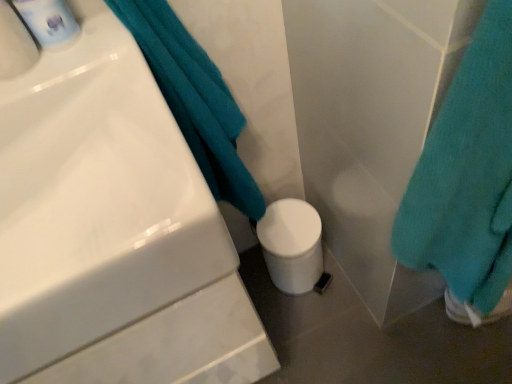
Question: In terms of height, does teal soft towel at lower right, the 2th bath towel viewed from the left, look taller or shorter compared to teal soft towel at upper left, which appears as the second bath towel when viewed from the right?

Choices:
 (A) tall
 (B) short

Answer: (A)

Question: In the image, is teal soft towel at lower right, the 2th bath towel viewed from the left, on the left side or the right side of teal soft towel at upper left, which appears as the second bath towel when viewed from the right?

Choices:
 (A) left
 (B) right

Answer: (B)

Question: Estimate the real-world distances between objects in this image. Which object is closer to the white glossy mouthwash at upper left?

Choices:
 (A) teal soft towel at lower right, the 2th bath towel viewed from the left
 (B) teal soft towel at upper left, which appears as the second bath towel when viewed from the right
 (C) white glossy sink at upper left

Answer: (B)

Question: Considering the real-world distances, which object is closest to the white glossy sink at upper left?

Choices:
 (A) white glossy mouthwash at upper left
 (B) teal soft towel at lower right, the 2th bath towel viewed from the left
 (C) teal soft towel at upper left, the 1th bath towel positioned from the left

Answer: (C)